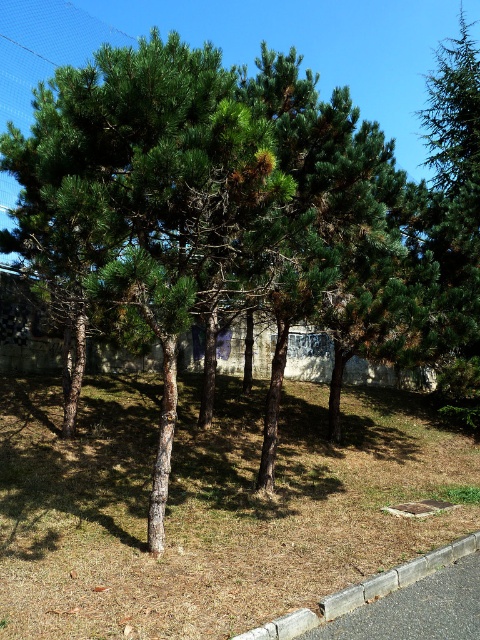
Question: Does green needle-like at upper right lie in front of gray concrete curb at lower right?

Choices:
 (A) yes
 (B) no

Answer: (B)

Question: Which object appears farthest from the camera in this image?

Choices:
 (A) green needle-like at upper right
 (B) gray concrete curb at lower right
 (C) brown dry grass at center

Answer: (A)

Question: Is the position of brown dry grass at center more distant than that of green needle-like at upper right?

Choices:
 (A) no
 (B) yes

Answer: (A)

Question: Does green needle-like at upper right lie behind gray concrete curb at lower right?

Choices:
 (A) no
 (B) yes

Answer: (B)

Question: Which object is positioned closest to the gray concrete curb at lower right?

Choices:
 (A) green needle-like at upper right
 (B) brown dry grass at center

Answer: (B)

Question: Which of these objects is positioned farthest from the gray concrete curb at lower right?

Choices:
 (A) brown dry grass at center
 (B) green needle-like at upper right

Answer: (B)